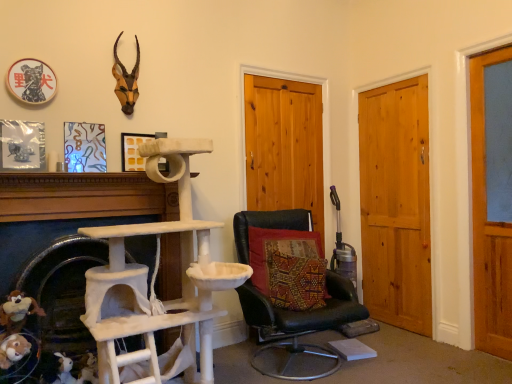
Question: Relative to white fabric cat tree at left, is brown plush toy at lower left, positioned as the second toy in back-to-front order, in front or behind?

Choices:
 (A) behind
 (B) front

Answer: (B)

Question: Is point (17, 326) positioned closer to the camera than point (53, 203)?

Choices:
 (A) farther
 (B) closer

Answer: (B)

Question: Considering the real-world distances, which object is closest to the wooden door at right, the first door viewed from the right?

Choices:
 (A) black leather chair at center
 (B) wooden door at center, which is counted as the third door, starting from the right
 (C) fuzzy fabric bunny at lower left, the first toy from the right
 (D) brown plush toy at lower left, arranged as the second toy when viewed from the right
 (E) white fabric cat tree at left

Answer: (A)

Question: Which object is the closest to the natural wood door at center right, the 2th door from the right?

Choices:
 (A) fuzzy fabric bunny at lower left, the 1th toy from the bottom
 (B) brown plush toy at lower left, which is the 1th toy in left-to-right order
 (C) textured red cushion at center
 (D) matte yellow picture frame at center
 (E) white fabric cat tree at left

Answer: (C)